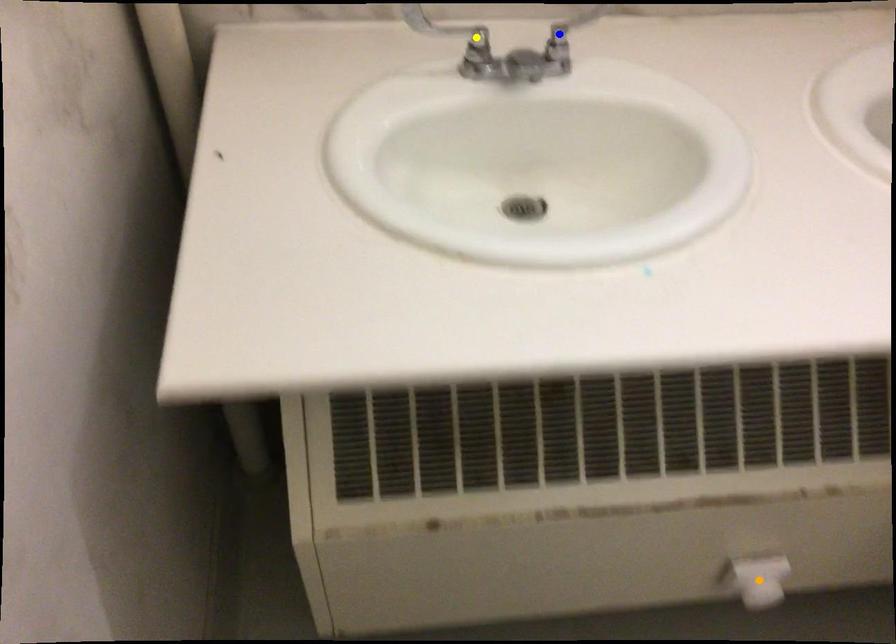
Looking at this image, order these from farthest to nearest:
- blue point
- yellow point
- orange point

orange point → blue point → yellow point